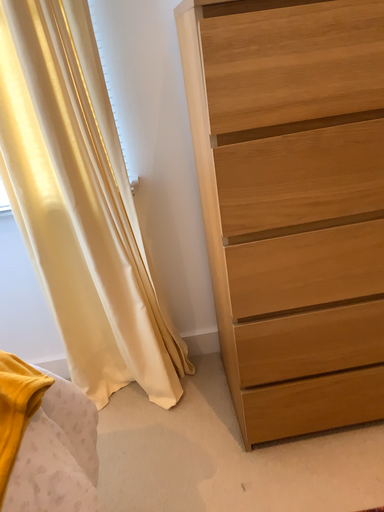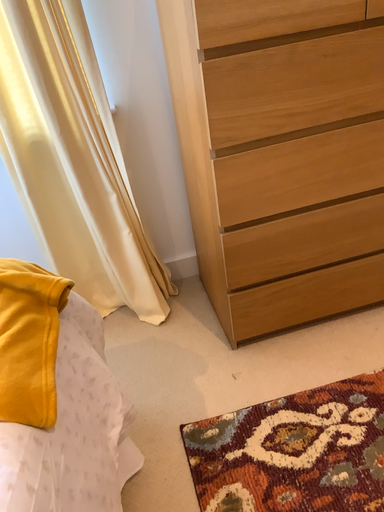
Question: Which way did the camera rotate in the video?

Choices:
 (A) rotated right
 (B) rotated left

Answer: (A)